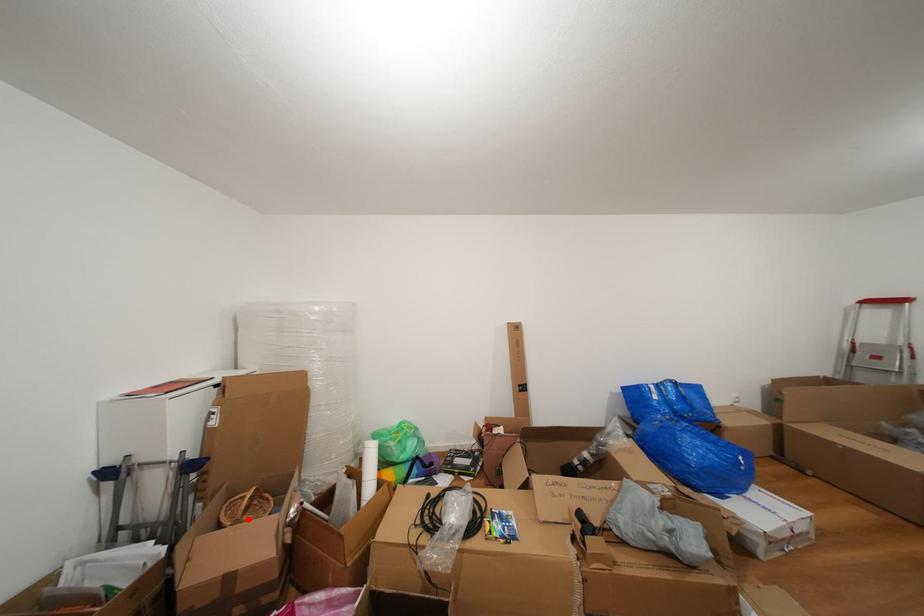
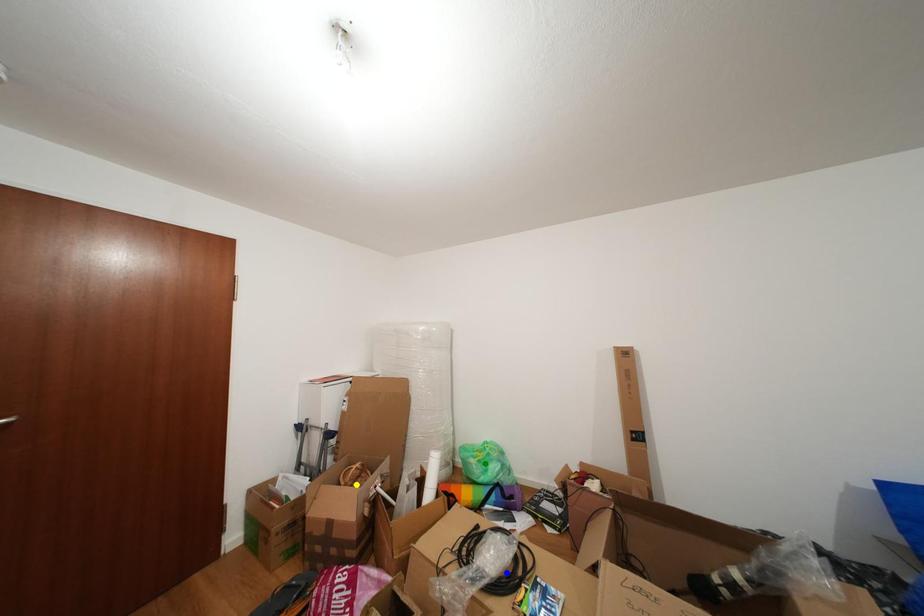
Question: I am providing you with two images of the same scene from different viewpoints. A red point is marked on the first image. You are given multiple points on the second image. Which point in image 2 is actually the same real-world point as the red point in image 1?

Choices:
 (A) yellow point
 (B) blue point
 (C) green point

Answer: (A)